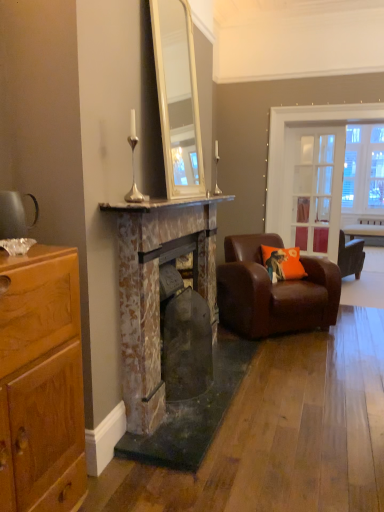
Find the location of `silver metallic table lamp at upper center, which is counted as the second table lamp, starting from the front`. silver metallic table lamp at upper center, which is counted as the second table lamp, starting from the front is located at coordinates (216, 168).

This screenshot has width=384, height=512. What do you see at coordinates (216, 168) in the screenshot? I see `silver metallic table lamp at upper center, which is counted as the 1th table lamp, starting from the back` at bounding box center [216, 168].

Locate an element on the screen. The image size is (384, 512). marble mantel at center is located at coordinates (164, 204).

From the image's perspective, is brown leather armchair at right positioned above or below shiny brown cabinet at left?

brown leather armchair at right is above shiny brown cabinet at left.

Is brown leather armchair at right thinner than shiny brown cabinet at left?

Incorrect, the width of brown leather armchair at right is not less than that of shiny brown cabinet at left.

What's the angular difference between brown leather armchair at right and shiny brown cabinet at left's facing directions?

The facing directions of brown leather armchair at right and shiny brown cabinet at left are 46.3 degrees apart.

The width and height of the screenshot is (384, 512). Find the location of `cabinetry located below the brown leather armchair at right (from the image's perspective)`. cabinetry located below the brown leather armchair at right (from the image's perspective) is located at coordinates 41,382.

In the image, is clear glass door at center positioned in front of or behind rusty stone fireplace at center, placed as the 1th fireplace when sorted from back to front?

Visually, clear glass door at center is located behind rusty stone fireplace at center, placed as the 1th fireplace when sorted from back to front.

Between clear glass door at center and rusty stone fireplace at center, placed as the 1th fireplace when sorted from back to front, which one has less height?

With less height is rusty stone fireplace at center, placed as the 1th fireplace when sorted from back to front.

Is rusty stone fireplace at center, acting as the second fireplace starting from the front, inside clear glass door at center?

Actually, rusty stone fireplace at center, acting as the second fireplace starting from the front, is outside clear glass door at center.

Which of these two, marble mantel at center or clear glass door at center, is bigger?

clear glass door at center.

Between point (171, 200) and point (324, 164), which one is positioned in front?

The point (171, 200) is in front.

Where is `mantle below the clear glass door at center (from the image's perspective)`? The width and height of the screenshot is (384, 512). mantle below the clear glass door at center (from the image's perspective) is located at coordinates (164, 204).

From their relative heights in the image, would you say marble mantel at center is taller or shorter than clear glass door at center?

In the image, marble mantel at center appears to be shorter than clear glass door at center.

Which is more to the left, brown leather armchair at right or silver metallic candlestick at upper center, positioned as the first table lamp in left-to-right order?

From the viewer's perspective, silver metallic candlestick at upper center, positioned as the first table lamp in left-to-right order, appears more on the left side.

Starting from the brown leather armchair at right, which table lamp is the 2nd one in front? Please provide its 2D coordinates.

[(134, 164)]

Which object is closer to the camera, brown leather armchair at right or silver metallic candlestick at upper center, the second table lamp when ordered from back to front?

Positioned in front is silver metallic candlestick at upper center, the second table lamp when ordered from back to front.

Are brown leather armchair at right and silver metallic candlestick at upper center, arranged as the first table lamp when viewed from the front, located far from each other?

Yes, brown leather armchair at right and silver metallic candlestick at upper center, arranged as the first table lamp when viewed from the front, are located far from each other.

From a real-world perspective, is silver metallic candlestick at upper center, positioned as the first table lamp in left-to-right order, above or below wooden table at right?

Clearly, from a real-world perspective, silver metallic candlestick at upper center, positioned as the first table lamp in left-to-right order, is above wooden table at right.

In the image, there is a silver metallic candlestick at upper center, which is counted as the 2th table lamp, starting from the right. In order to click on table below it (from a real-world perspective) in this screenshot , I will do `click(366, 233)`.

Is wooden table at right a part of silver metallic candlestick at upper center, which is counted as the 2th table lamp, starting from the right?

No, silver metallic candlestick at upper center, which is counted as the 2th table lamp, starting from the right, does not contain wooden table at right.

Considering the sizes of silver metallic candlestick at upper center, arranged as the first table lamp when viewed from the front, and wooden table at right in the image, is silver metallic candlestick at upper center, arranged as the first table lamp when viewed from the front, bigger or smaller than wooden table at right?

In the image, silver metallic candlestick at upper center, arranged as the first table lamp when viewed from the front, appears to be smaller than wooden table at right.

From a real-world perspective, is orange fabric pillow at right physically located above or below brown leather armchair at right?

orange fabric pillow at right is above brown leather armchair at right.

Is orange fabric pillow at right facing towards brown leather armchair at right?

Yes, orange fabric pillow at right is oriented towards brown leather armchair at right.

Can you confirm if orange fabric pillow at right is positioned to the left of brown leather armchair at right?

No, orange fabric pillow at right is not to the left of brown leather armchair at right.

How much distance is there between orange fabric pillow at right and brown leather armchair at right?

orange fabric pillow at right is 30.76 centimeters from brown leather armchair at right.

Measure the distance between wooden table at right and silver metallic candlestick at upper center, which is counted as the 2th table lamp, starting from the right.

wooden table at right and silver metallic candlestick at upper center, which is counted as the 2th table lamp, starting from the right, are 12.50 feet apart from each other.

From a real-world perspective, who is located higher, wooden table at right or silver metallic candlestick at upper center, which is counted as the 2th table lamp, starting from the right?

From a 3D spatial view, silver metallic candlestick at upper center, which is counted as the 2th table lamp, starting from the right, is above.

Does wooden table at right lie in front of silver metallic candlestick at upper center, positioned as the first table lamp in left-to-right order?

No, it is not.

Is wooden table at right touching silver metallic candlestick at upper center, which is counted as the 2th table lamp, starting from the right?

wooden table at right is not next to silver metallic candlestick at upper center, which is counted as the 2th table lamp, starting from the right, and they're not touching.

What are the coordinates of `cabinetry located above the brown leather armchair at right (from a real-world perspective)` in the screenshot? It's located at (41, 382).

This screenshot has height=512, width=384. In order to click on the 2nd fireplace below the clear glass door at center (from the image's perspective) in this screenshot , I will do `click(185, 338)`.

Considering their positions, is clear glass door at center positioned closer to rusty stone fireplace at center, placed as the 1th fireplace when sorted from back to front, than marble mantel at center?

marble mantel at center is closer to rusty stone fireplace at center, placed as the 1th fireplace when sorted from back to front.

Looking at this image, based on their spatial positions, is rusty stone fireplace at center, placed as the 1th fireplace when sorted from back to front, or shiny brown cabinet at left further from rustic stone fireplace at center, placed as the 2th fireplace when sorted from back to front?

shiny brown cabinet at left is further to rustic stone fireplace at center, placed as the 2th fireplace when sorted from back to front.

Considering their positions, is rusty stone fireplace at center, acting as the second fireplace starting from the front, positioned closer to clear glass door at center than orange fabric pillow at right?

orange fabric pillow at right lies closer to clear glass door at center than the other object.

Estimate the real-world distances between objects in this image. Which object is further from clear glass door at center, shiny brown cabinet at left or brown leather armchair at right?

Among the two, shiny brown cabinet at left is located further to clear glass door at center.

Which object lies nearer to the anchor point rustic stone fireplace at center, placed as the 1th fireplace when sorted from front to back, silver metallic table lamp at upper center, which is counted as the second table lamp, starting from the front, or brown leather armchair at right?

brown leather armchair at right is positioned closer to the anchor rustic stone fireplace at center, placed as the 1th fireplace when sorted from front to back.

When comparing their distances from rustic stone fireplace at center, placed as the 2th fireplace when sorted from back to front, does marble mantel at center or brown leather armchair at right seem further?

Result: brown leather armchair at right lies further to rustic stone fireplace at center, placed as the 2th fireplace when sorted from back to front, than the other object.

Which object lies further to the anchor point rusty stone fireplace at center, acting as the second fireplace starting from the front, clear glass door at center or orange fabric pillow at right?

clear glass door at center is further to rusty stone fireplace at center, acting as the second fireplace starting from the front.

From the image, which object appears to be nearer to silver metallic table lamp at upper center, which is counted as the second table lamp, starting from the left, brown leather armchair at right or rustic stone fireplace at center, placed as the 1th fireplace when sorted from front to back?

brown leather armchair at right is closer to silver metallic table lamp at upper center, which is counted as the second table lamp, starting from the left.

Identify the location of chair between rusty stone fireplace at center, placed as the 1th fireplace when sorted from back to front, and orange fabric pillow at right, along the z-axis. This screenshot has height=512, width=384. (273, 291).

Image resolution: width=384 pixels, height=512 pixels. I want to click on glass door between orange fabric pillow at right and wooden table at right from front to back, so click(x=314, y=188).

Locate an element on the screen. The width and height of the screenshot is (384, 512). pillow between marble mantel at center and wooden table at right along the z-axis is located at coordinates (283, 262).

Identify the location of table lamp located between marble mantel at center and silver metallic table lamp at upper center, which is the 1th table lamp from right to left, in the depth direction. This screenshot has width=384, height=512. (134, 164).